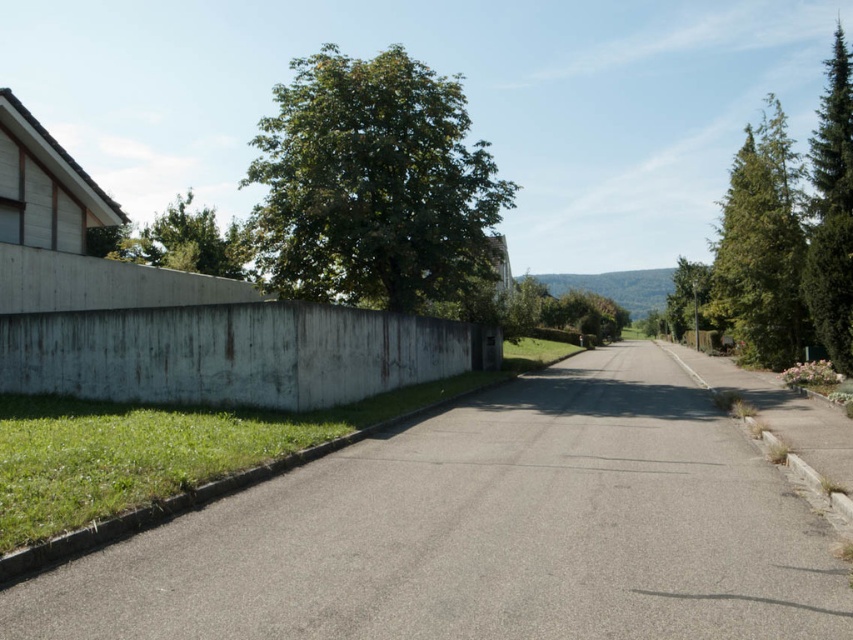
You are standing at the point with coordinates point (213, 250) and want to walk to the point with coordinates point (271, 372). Given the suburban street scene described, will you need to walk forward or backward to reach your destination?

Since point (271, 372) is in front of point (213, 250), you will need to walk forward to reach the destination.

You are a bird looking for a place to perch. You see a green leafy tree at center and a green textured tree at right. Which tree is closer to the road?

The green leafy tree at center is positioned over the green textured tree at right, meaning it is closer to the road.